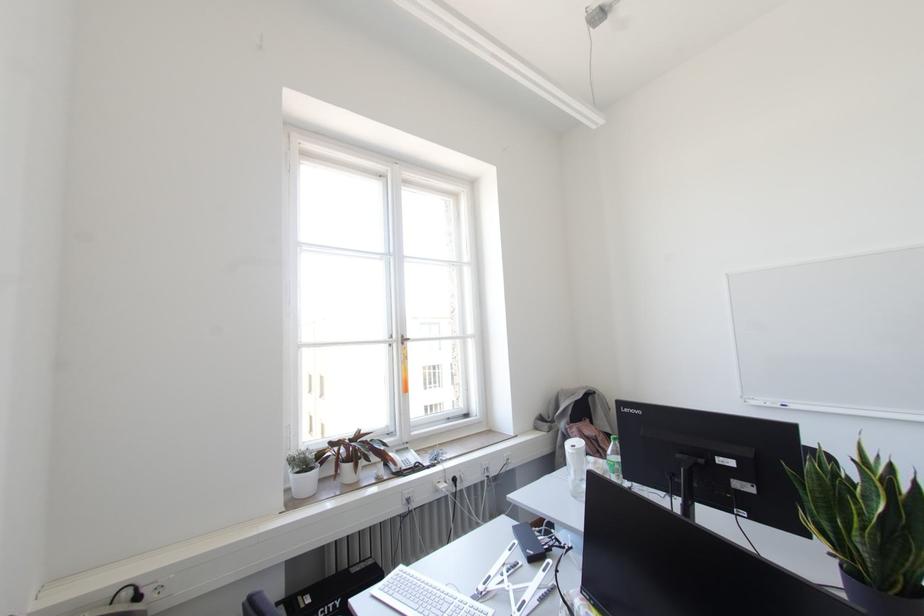
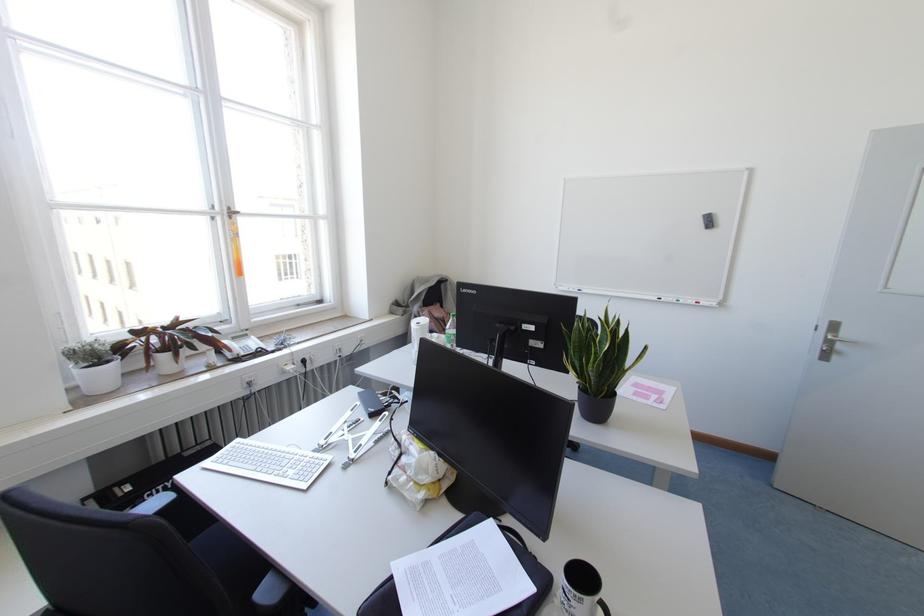
Based on the continuous images, in which direction is the camera rotating?

A: The rotation direction of the camera is right-down.